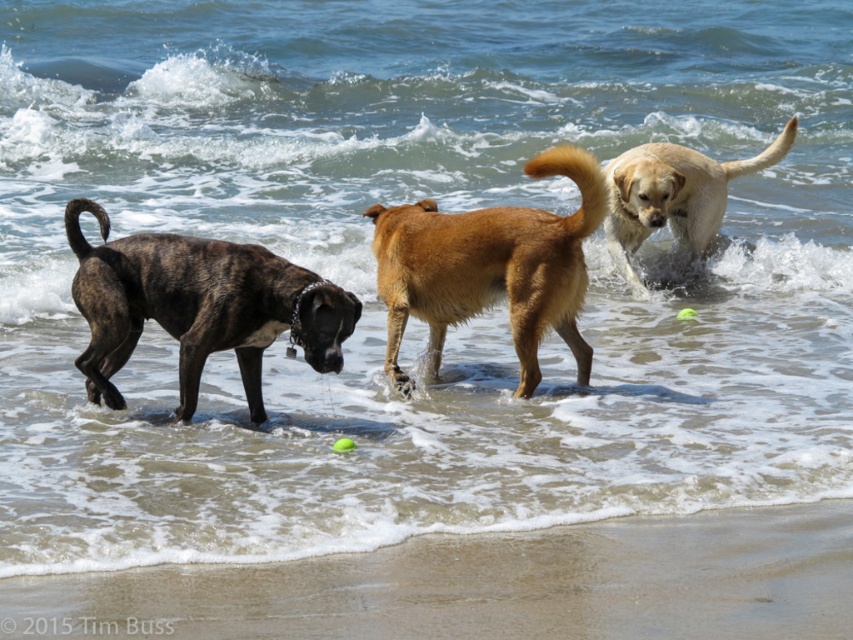
You are a drone operator trying to capture a photo of the sandy beach at lower center. You are currently hovering at point (489, 586). Is your current position directly above the sandy beach at lower center?

Yes, the point (489, 586) is directly above the sandy beach at lower center as stated in the Objects Description.

You are a dog trainer who wants to throw a tennis ball between the golden fur dog at center and the light brown fur dog at right. Can you fit a tennis ball between them if the ball has a diameter of 2.5 inches?

The golden fur dog at center and light brown fur dog at right are 6.83 feet apart from each other. Since 6.83 feet is equivalent to 81.96 inches, there is enough space to fit a tennis ball with a diameter of 2.5 inches between them.

You are a photographer trying to capture a photo of the two points in the image. Which point, point (350, 296) or point (695, 225), will appear larger in your photo?

Point (350, 296) will appear larger in the photo because it is closer to the camera than point (695, 225).